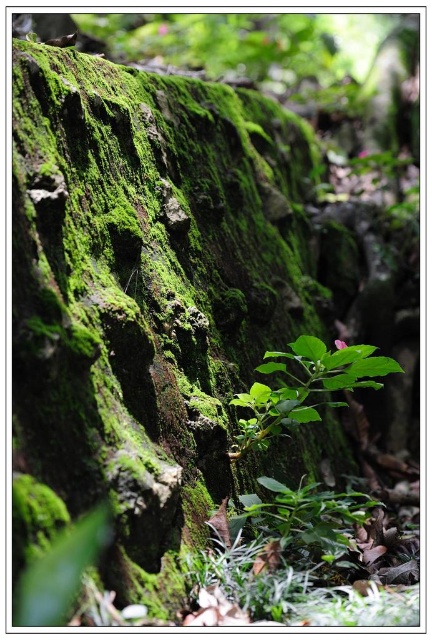
Question: Which point is closer to the camera?

Choices:
 (A) green leafy plant at lower center
 (B) green leafy plant at center

Answer: (A)

Question: From the image, what is the correct spatial relationship of green leafy plant at center in relation to green leafy plant at lower center?

Choices:
 (A) below
 (B) above

Answer: (B)

Question: Is green leafy plant at center bigger than green leafy plant at lower center?

Choices:
 (A) no
 (B) yes

Answer: (A)

Question: Does green leafy plant at center have a lesser width compared to green leafy plant at lower center?

Choices:
 (A) no
 (B) yes

Answer: (B)

Question: Which point is farther to the camera?

Choices:
 (A) green leafy plant at center
 (B) green leafy plant at lower center

Answer: (A)